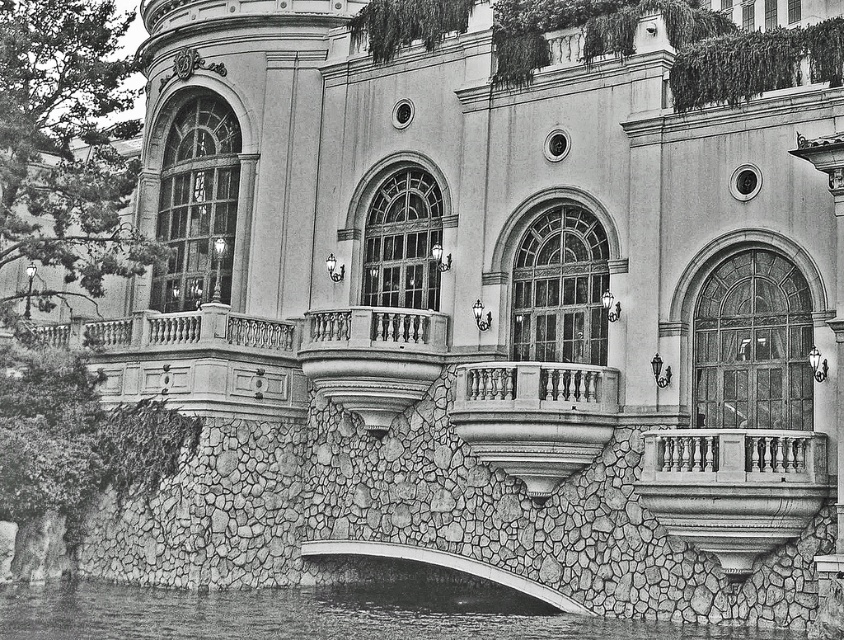
You are an architect planning to install a new decorative element between the smooth stone balcony at center and the textured stone wall at lower section. The decorative element requires a minimum of 50 meters of space between the two structures. Based on the provided measurements, will there be enough space for the installation?

The distance between the smooth stone balcony at center and the textured stone wall at lower section is 49.56 meters, which is slightly less than the required 50 meters. Therefore, there is insufficient space for the installation.